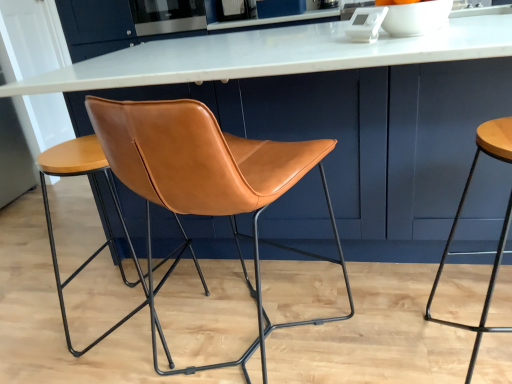
Question: Can you confirm if white marble table at center is shorter than leather at center, the 1th stool from the left?

Choices:
 (A) yes
 (B) no

Answer: (B)

Question: Is white marble table at center positioned beyond the bounds of leather at center, the 1th stool from the left?

Choices:
 (A) no
 (B) yes

Answer: (B)

Question: Can you confirm if white marble table at center is smaller than leather at center, acting as the 2th stool starting from the right?

Choices:
 (A) no
 (B) yes

Answer: (A)

Question: Is white marble table at center far away from leather at center, the 1th stool from the left?

Choices:
 (A) no
 (B) yes

Answer: (A)

Question: Is leather at center, acting as the 2th stool starting from the right, at the back of white marble table at center?

Choices:
 (A) no
 (B) yes

Answer: (A)

Question: Based on their positions, is satin stainless steel oven at upper center located to the left or right of saddle brown leather chair at center?

Choices:
 (A) right
 (B) left

Answer: (B)

Question: Is satin stainless steel oven at upper center wider or thinner than saddle brown leather chair at center?

Choices:
 (A) wide
 (B) thin

Answer: (B)

Question: In terms of height, does satin stainless steel oven at upper center look taller or shorter compared to saddle brown leather chair at center?

Choices:
 (A) tall
 (B) short

Answer: (B)

Question: In the image, is satin stainless steel oven at upper center positioned in front of or behind saddle brown leather chair at center?

Choices:
 (A) front
 (B) behind

Answer: (B)

Question: Is point (181, 11) positioned closer to the camera than point (479, 344)?

Choices:
 (A) farther
 (B) closer

Answer: (A)

Question: From a real-world perspective, is satin stainless steel oven at upper center physically located above or below matte brown stool at right, which is the 1th stool from right to left?

Choices:
 (A) above
 (B) below

Answer: (A)

Question: In the image, is satin stainless steel oven at upper center positioned in front of or behind matte brown stool at right, marked as the second stool in a left-to-right arrangement?

Choices:
 (A) front
 (B) behind

Answer: (B)

Question: From the image's perspective, is satin stainless steel oven at upper center located above or below matte brown stool at right, marked as the second stool in a left-to-right arrangement?

Choices:
 (A) above
 (B) below

Answer: (A)

Question: Considering the positions of white marble table at center and satin stainless steel oven at upper center in the image, is white marble table at center wider or thinner than satin stainless steel oven at upper center?

Choices:
 (A) thin
 (B) wide

Answer: (B)

Question: Is white marble table at center bigger or smaller than satin stainless steel oven at upper center?

Choices:
 (A) big
 (B) small

Answer: (A)